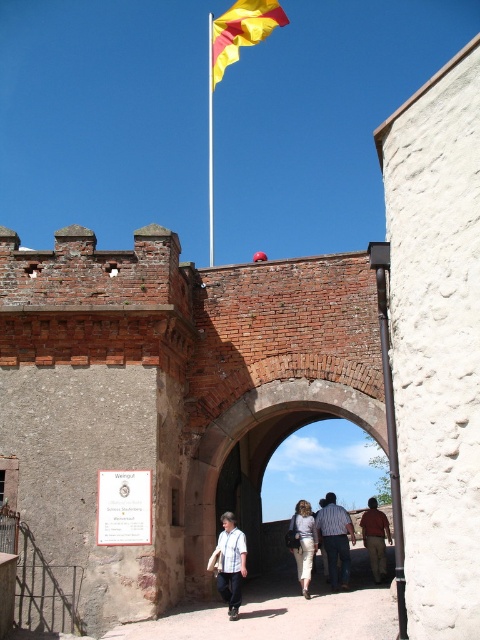
You are a photographer standing in front of the historic stone archway. You notice a light beige skirt at center and a brown leather jacket at center in the scene. Which clothing item is closer to you?

The light beige skirt at center is closer to you because it is in front of the brown leather jacket at center.

You are a tailor who needs to determine if the brown leather jacket at center can fit into a display case designed for items narrower than the metallic flagpole at upper center. Can the jacket fit?

The brown leather jacket at center has a larger width than the metallic flagpole at upper center, so it cannot fit into the display case designed for items narrower than the metallic flagpole at upper center.

You are standing at point (303, 595). The flagpole is 145.39 feet away from you. Can you see the flagpole from your current position?

Yes, the flagpole is 145.39 feet away from point (303, 595), so you can see it from your current position.